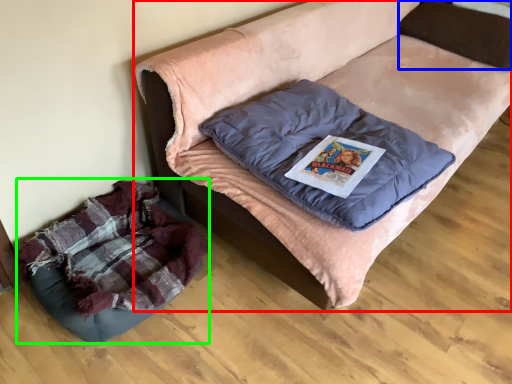
Question: Estimate the real-world distances between objects in this image. Which object is closer to furniture (highlighted by a red box), pillow (highlighted by a blue box) or dog bed (highlighted by a green box)?

Choices:
 (A) pillow
 (B) dog bed

Answer: (A)